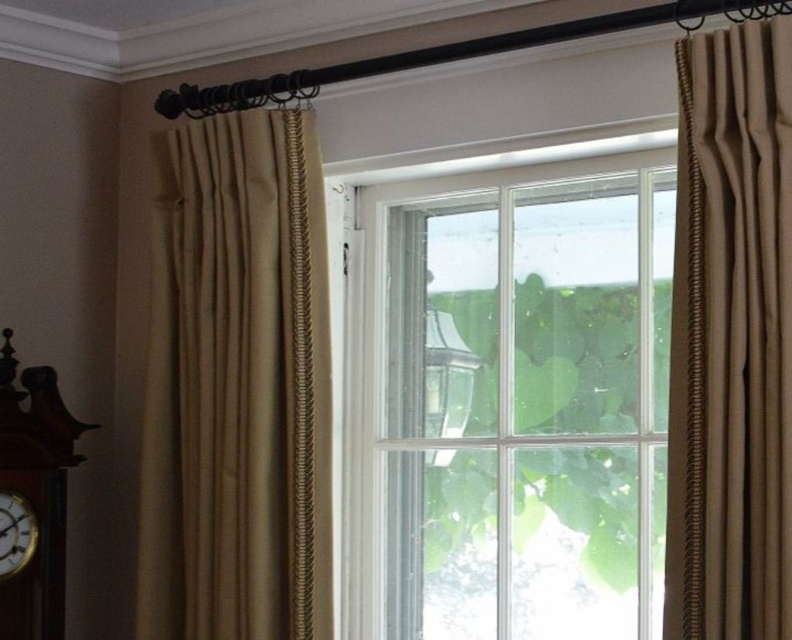
Who is taller, wooden clock at left or wooden clock at lower left?

wooden clock at left

Between point (56, 396) and point (2, 570), which one is positioned behind?

Point (56, 396)

Measure the distance between wooden clock at left and camera.

wooden clock at left is 5.75 feet from camera.

You are a GUI agent. You are given a task and a screenshot of the screen. Output one action in this format:
    pyautogui.click(x=<x>, y=<y>)
    Task: Click on the wooden clock at left
    The height and width of the screenshot is (640, 792).
    Given the screenshot: What is the action you would take?
    pyautogui.click(x=33, y=497)

In the scene shown: Between beige textured curtain at right and clear glass lamp at center, which one appears on the left side from the viewer's perspective?

From the viewer's perspective, clear glass lamp at center appears more on the left side.

Between beige textured curtain at right and clear glass lamp at center, which one has less height?

Standing shorter between the two is clear glass lamp at center.

Describe the element at coordinates (730, 339) in the screenshot. I see `beige textured curtain at right` at that location.

Locate an element on the screen. beige textured curtain at right is located at coordinates 730,339.

Between point (297, 369) and point (65, 436), which one is positioned behind?

The point (65, 436) is more distant.

You are a GUI agent. You are given a task and a screenshot of the screen. Output one action in this format:
    pyautogui.click(x=<x>, y=<y>)
    Task: Click on the beige textured curtain at left
    The image size is (792, 640).
    Given the screenshot: What is the action you would take?
    pyautogui.click(x=238, y=387)